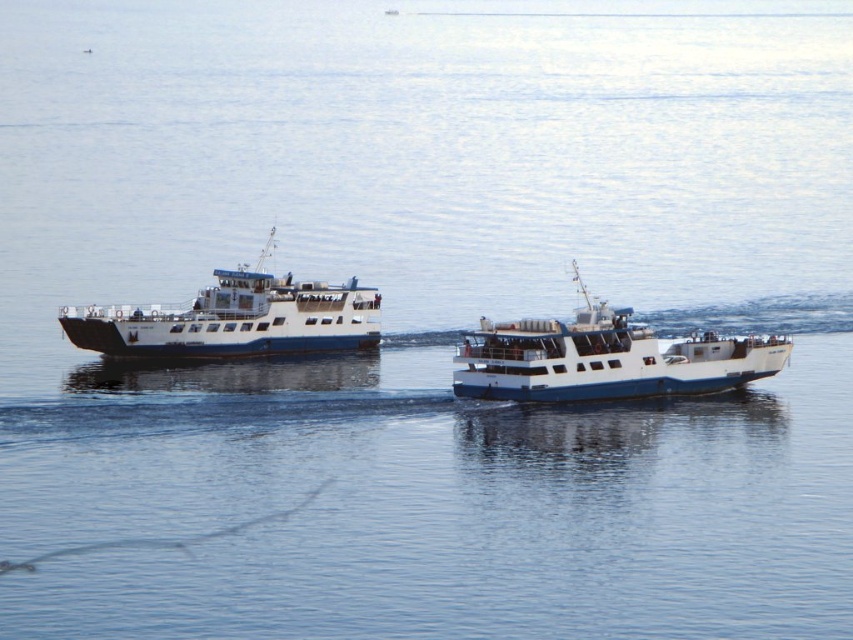
You are standing on the dock and want to board the closest ferry. You see the white matte boat at center and the white matte ferry at left. Which one is closer to the dock?

The white matte ferry at left is closer to the dock because the white matte boat at center is 12.01 meters away from the white matte ferry at left, meaning the ferry is nearer to the dock than the boat.

You are a passenger on the white matte ferry at left and want to move to the white matte boat at center. Which direction should you go?

The white matte boat at center is to the right of the white matte ferry at left, so you should go to the right to reach it.

Based on the coordinates provided, where is the white matte boat at center located in the image?

The white matte boat at center is located at point (604, 358).